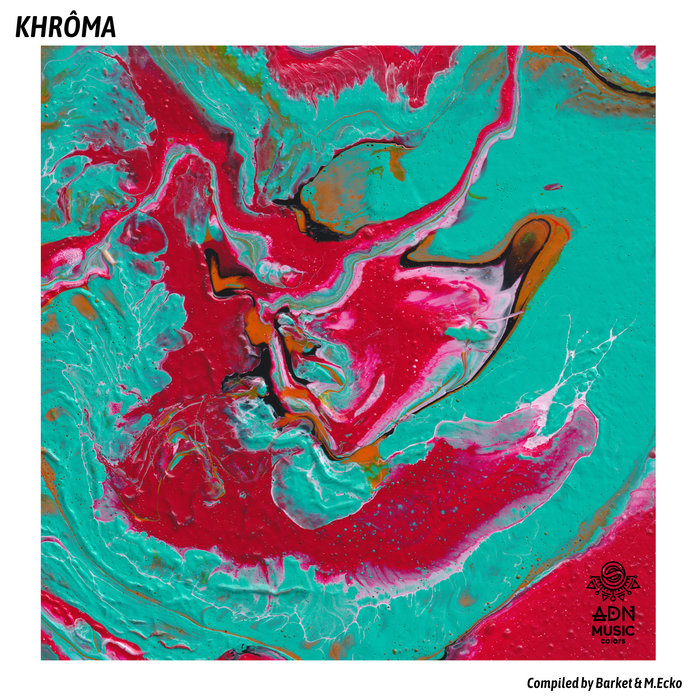
Locate an element on the screen. The height and width of the screenshot is (700, 700). red in center of painting is located at coordinates (391, 379), (216, 362), (241, 508), (409, 542).